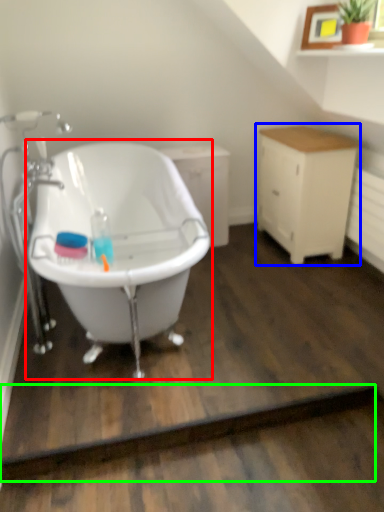
Question: Based on their relative distances, which object is farther from bathtub (highlighted by a red box)? Choose from cabinetry (highlighted by a blue box) and plank (highlighted by a green box).

Choices:
 (A) cabinetry
 (B) plank

Answer: (A)